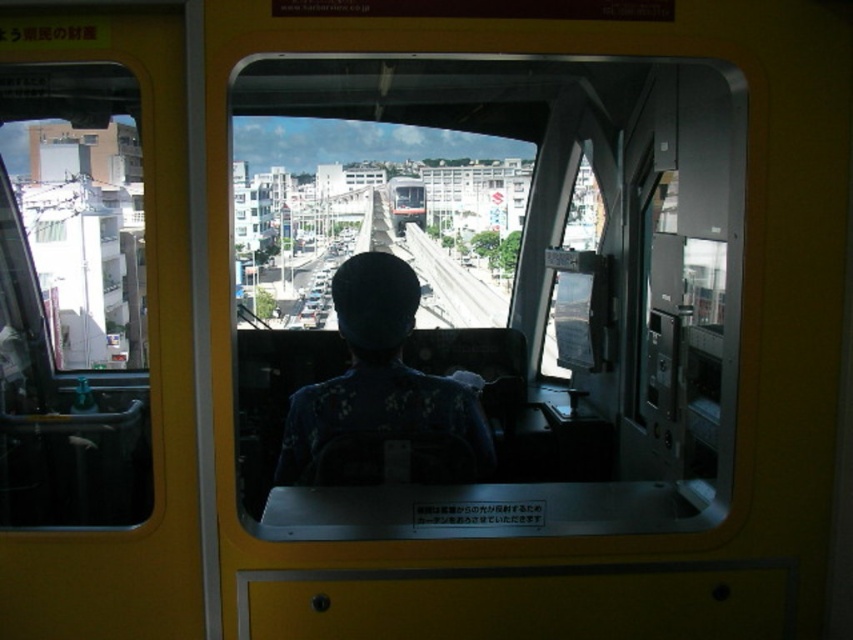
Question: Does transparent glass train window at center have a smaller size compared to dark blue uniform at center?

Choices:
 (A) no
 (B) yes

Answer: (A)

Question: Which of the following is the farthest from the observer?

Choices:
 (A) transparent glass train window at center
 (B) dark blue uniform at center
 (C) transparent glass train window at upper left

Answer: (B)

Question: Among these objects, which one is farthest from the camera?

Choices:
 (A) dark blue uniform at center
 (B) transparent glass train window at center
 (C) transparent glass train window at upper left

Answer: (A)

Question: Is transparent glass train window at upper left behind dark blue uniform at center?

Choices:
 (A) no
 (B) yes

Answer: (A)

Question: Which point is closer to the camera?

Choices:
 (A) (305, 208)
 (B) (73, 499)
 (C) (386, 396)

Answer: (A)

Question: Does transparent glass train window at upper left have a smaller size compared to dark blue uniform at center?

Choices:
 (A) yes
 (B) no

Answer: (B)